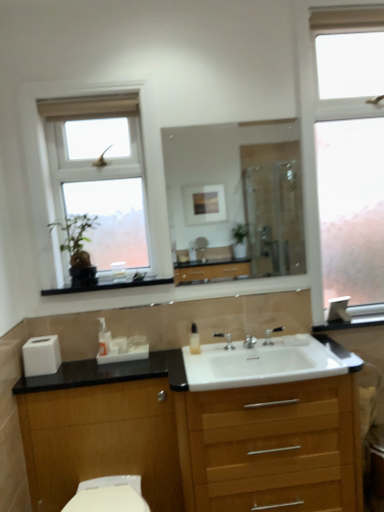
Find the location of a particular element. The image size is (384, 512). free space between white matte toilet paper at lower left and translucent plastic soap dispenser at center, marked as the second soap dispenser in a right-to-left arrangement is located at coordinates (75, 368).